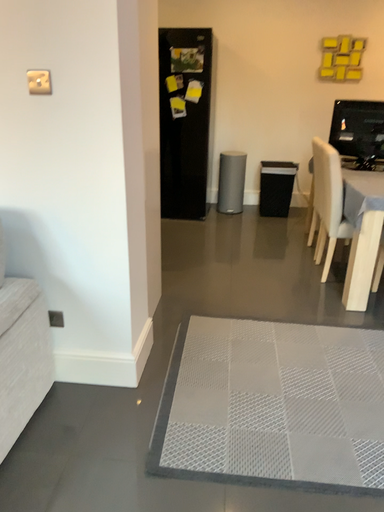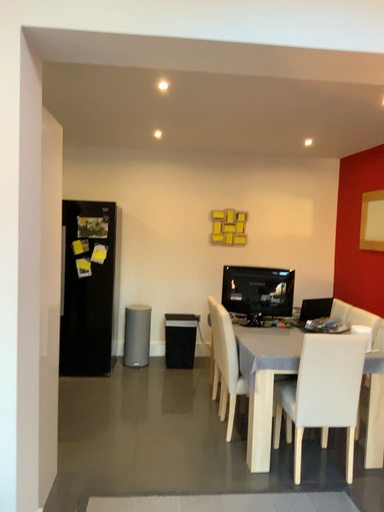
Question: How did the camera likely rotate when shooting the video?

Choices:
 (A) rotated downward
 (B) rotated upward

Answer: (B)